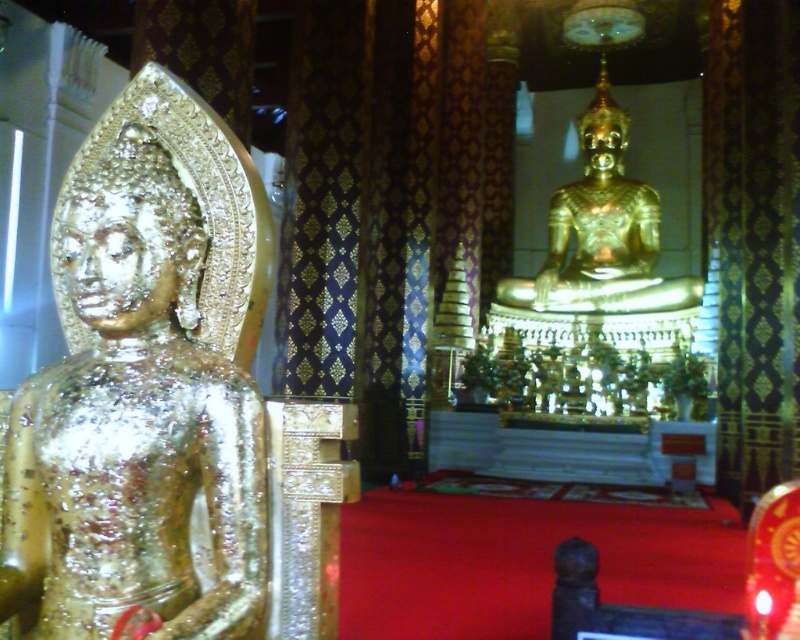
You are a temple visitor who wants to take a photo of both the gold shiny statue at left and the gold polished statue at center in the same frame. Given that your camera has a maximum zoom range of 50 meters, can you capture both statues in a single photo without moving your position?

The distance between the gold shiny statue at left and the gold polished statue at center is 69.89 meters. Since your camera can only zoom up to 50 meters, you cannot capture both statues in a single photo without moving your position.

You are an architect designing a new temple and want to place a small altar between the gold shiny statue at left and the gold polished statue at center. Given their widths, can the altar fit in the space between them?

The gold shiny statue at left has a lesser width compared to gold polished statue at center. Since the gold shiny statue at left is narrower, there should be sufficient space between them to place the small altar.